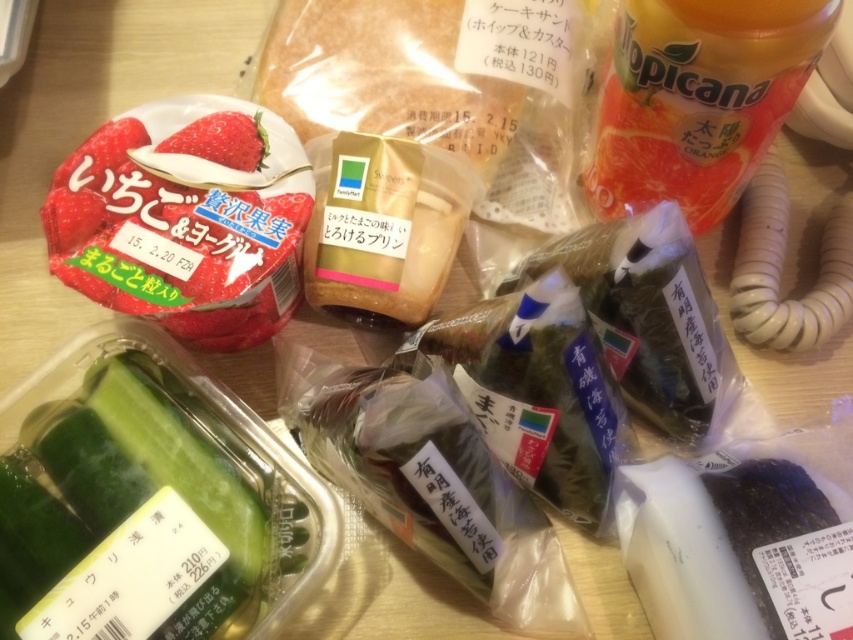
Question: Which of the following is the closest to the observer?

Choices:
 (A) green matte cucumber at lower left
 (B) matte plastic strawberry at center left
 (C) orange plastic bottle at upper right

Answer: (C)

Question: Which point is closer to the camera?

Choices:
 (A) green matte cucumber at lower left
 (B) orange plastic bottle at upper right
 (C) matte plastic strawberry at center left
 (D) matte white strawberry at upper center

Answer: (B)

Question: Does green matte cucumber at lower left have a lesser width compared to orange plastic bottle at upper right?

Choices:
 (A) no
 (B) yes

Answer: (A)

Question: Which of these objects is positioned closest to the matte plastic strawberry at center left?

Choices:
 (A) matte white strawberry at upper center
 (B) green matte cucumber at lower left
 (C) orange plastic bottle at upper right

Answer: (A)

Question: From the image, what is the correct spatial relationship of green matte cucumber at lower left in relation to matte white strawberry at upper center?

Choices:
 (A) above
 (B) below

Answer: (B)

Question: Is green matte cucumber at lower left positioned in front of matte white strawberry at upper center?

Choices:
 (A) no
 (B) yes

Answer: (B)